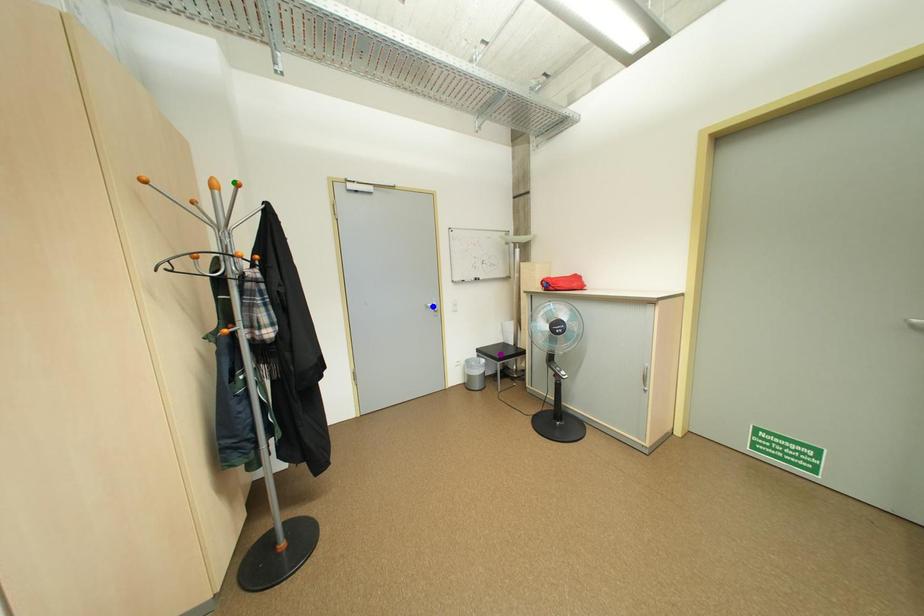
Order these from nearest to farthest:
green point, blue point, purple point

1. green point
2. blue point
3. purple point